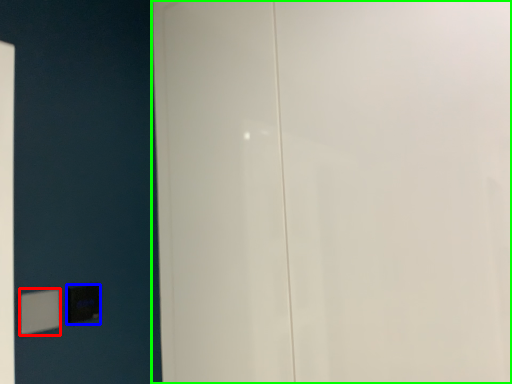
Question: Which object is the closest to the light switch (highlighted by a red box)? Choose among these: light switch (highlighted by a blue box) or door (highlighted by a green box).

Choices:
 (A) light switch
 (B) door

Answer: (A)